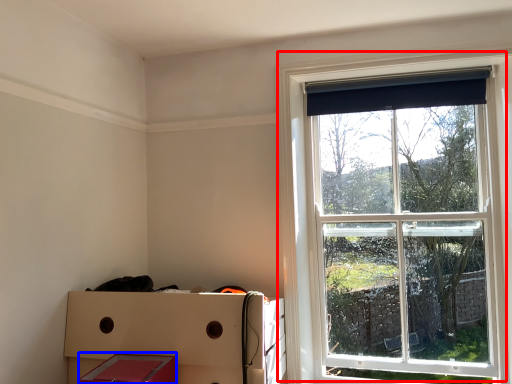
Question: Which object appears farthest to the camera in this image, window (highlighted by a red box) or storage box (highlighted by a blue box)?

Choices:
 (A) window
 (B) storage box

Answer: (A)